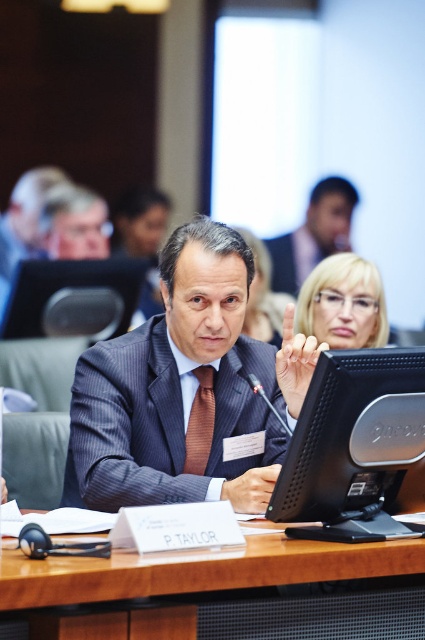
Which is more to the right, wooden table at center or black plastic monitor at center?

black plastic monitor at center is more to the right.

Can you confirm if wooden table at center is positioned below black plastic monitor at center?

Correct, wooden table at center is located below black plastic monitor at center.

Between point (99, 572) and point (413, 392), which one is positioned behind?

Positioned behind is point (413, 392).

What are the coordinates of `wooden table at center` in the screenshot? It's located at (215, 589).

The width and height of the screenshot is (425, 640). What do you see at coordinates (161, 420) in the screenshot? I see `matte blue pinstripe suit at center` at bounding box center [161, 420].

Can you confirm if matte blue pinstripe suit at center is positioned to the right of brown striped tie at center?

Incorrect, matte blue pinstripe suit at center is not on the right side of brown striped tie at center.

Where is `matte blue pinstripe suit at center`? This screenshot has width=425, height=640. matte blue pinstripe suit at center is located at coordinates (161, 420).

You are a GUI agent. You are given a task and a screenshot of the screen. Output one action in this format:
    pyautogui.click(x=<x>, y=<y>)
    Task: Click on the matte blue pinstripe suit at center
    This screenshot has width=425, height=640.
    Given the screenshot: What is the action you would take?
    pyautogui.click(x=161, y=420)

Which is more to the right, matte black suit at upper center or dark gray pinstripe suit at center?

Positioned to the right is matte black suit at upper center.

Is matte black suit at upper center below dark gray pinstripe suit at center?

Incorrect, matte black suit at upper center is not positioned below dark gray pinstripe suit at center.

The width and height of the screenshot is (425, 640). What do you see at coordinates (314, 234) in the screenshot? I see `matte black suit at upper center` at bounding box center [314, 234].

Image resolution: width=425 pixels, height=640 pixels. What are the coordinates of `matte black suit at upper center` in the screenshot? It's located at (314, 234).